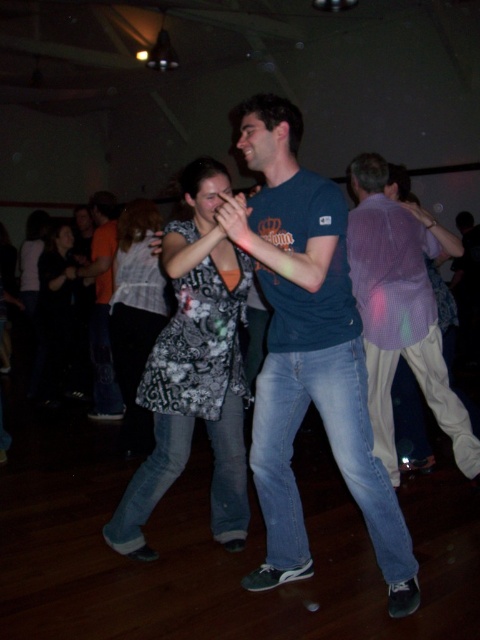
Question: Does light purple checkered shirt at right appear on the left side of black fabric dress at left?

Choices:
 (A) no
 (B) yes

Answer: (A)

Question: Is printed fabric dress at center positioned in front of light purple checkered shirt at right?

Choices:
 (A) yes
 (B) no

Answer: (A)

Question: Which of the following is the closest to the observer?

Choices:
 (A) (126, 276)
 (B) (244, 285)
 (C) (46, 324)

Answer: (B)

Question: Among these points, which one is nearest to the camera?

Choices:
 (A) [110, 276]
 (B) [113, 356]

Answer: (B)

Question: Does printed fabric dress at center have a greater width compared to black fabric dress at left?

Choices:
 (A) no
 (B) yes

Answer: (B)

Question: Which object appears closest to the camera in this image?

Choices:
 (A) blue cotton t-shirt at center
 (B) patterned fabric dress at lower left

Answer: (A)